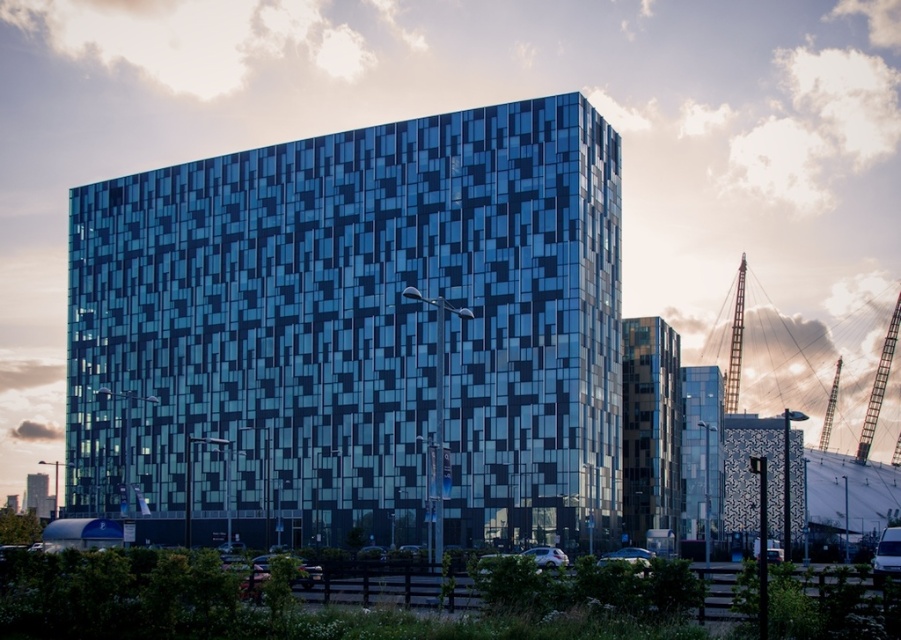
You are standing in front of the modern architectural structure and notice a metallic silver crane at right. Based on its position, can you determine if it is closer to the building or the wooden fence?

The metallic silver crane at right is located at point (878, 387), which places it closer to the building than the wooden fence.